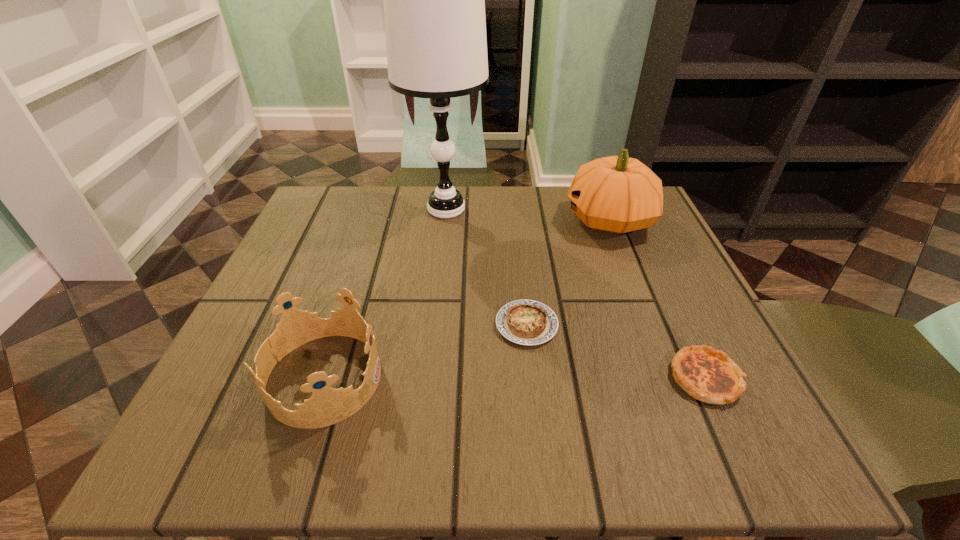
Find the location of `free region that satisfies the following two spatial constraints: 1. on the front side of the tallest object; 2. on the right side of the shorter quiche`. free region that satisfies the following two spatial constraints: 1. on the front side of the tallest object; 2. on the right side of the shorter quiche is located at coordinates (434, 325).

At what (x,y) coordinates should I click in order to perform the action: click on free region that satisfies the following two spatial constraints: 1. on the front side of the tallest object; 2. on the front-facing side of the tiara. Please return your answer as a coordinate pair (x, y). This screenshot has width=960, height=540. Looking at the image, I should click on (428, 378).